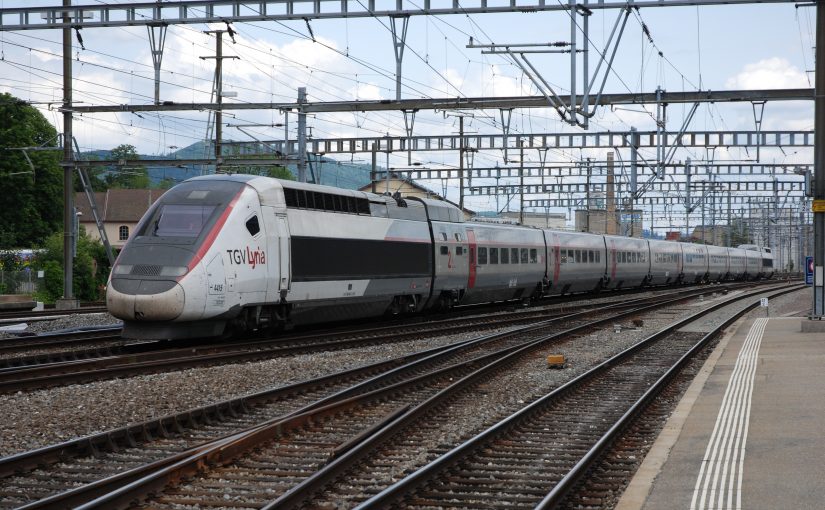
Where is `chimney`? The image size is (825, 510). chimney is located at coordinates (609, 159).